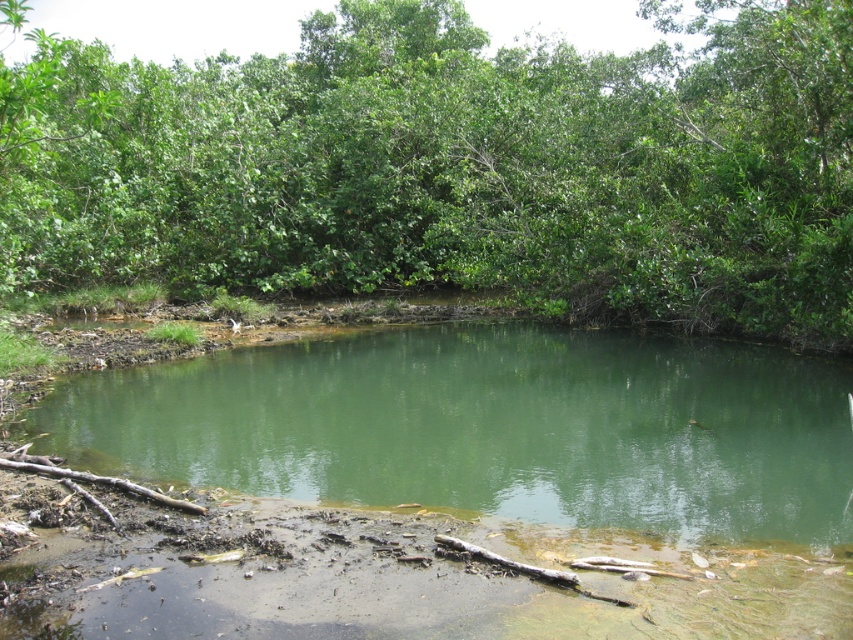
Question: Can you confirm if green leafy tree at upper center is positioned to the left of green muddy water at center?

Choices:
 (A) yes
 (B) no

Answer: (A)

Question: From the image, what is the correct spatial relationship of green leafy tree at upper center in relation to green muddy water at center?

Choices:
 (A) below
 (B) above

Answer: (B)

Question: Which of the following is the farthest from the observer?

Choices:
 (A) (364, 502)
 (B) (799, 26)

Answer: (B)

Question: Among these points, which one is nearest to the camera?

Choices:
 (A) (19, 106)
 (B) (360, 396)

Answer: (A)

Question: Considering the relative positions of green leafy tree at upper center and green muddy water at center in the image provided, where is green leafy tree at upper center located with respect to green muddy water at center?

Choices:
 (A) above
 (B) below

Answer: (A)